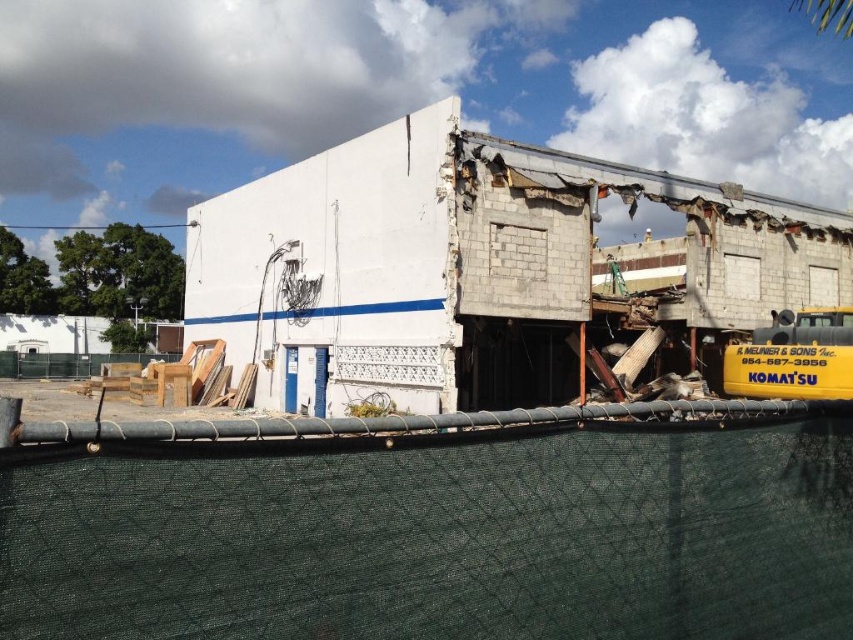
You are a delivery driver approaching the demolition site and see the white concrete building at center and the yellow matte school bus at right. Which object is closer to your current position?

The yellow matte school bus at right is closer to your current position because it is positioned to the left of the white concrete building at center, implying it is nearer in the scene.

You are a delivery driver who needs to park your truck next to the white concrete building at center without blocking the yellow matte school bus at right. Given that the truck is 10 meters long, can you safely park there considering the size difference between the two objects?

The white concrete building at center is larger than the yellow matte school bus at right. Since the truck is 10 meters long, it can be parked next to the white concrete building at center without blocking the school bus, as there is enough space due to the building being bigger.

You are a delivery driver approaching the white concrete building at center and the yellow matte school bus at right. Which object will you encounter first as you move towards the building?

The white concrete building at center is closer to the viewer than the yellow matte school bus at right, so you will encounter the white concrete building at center first.